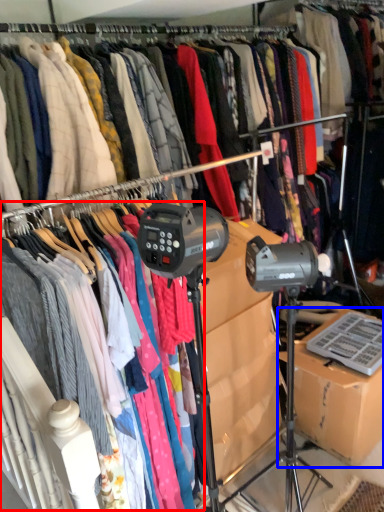
Question: Which object appears farthest to the camera in this image, clothing (highlighted by a red box) or cardboard box (highlighted by a blue box)?

Choices:
 (A) clothing
 (B) cardboard box

Answer: (B)